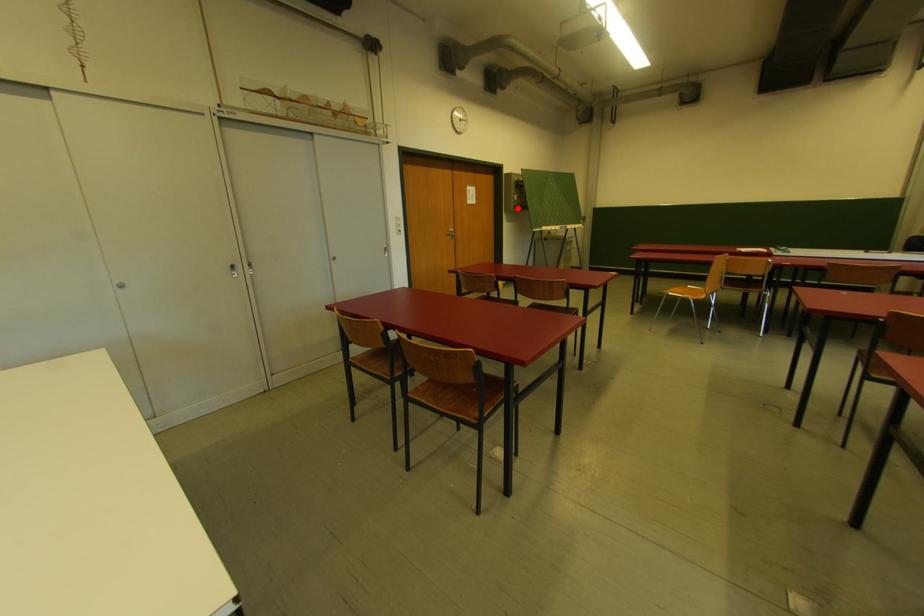
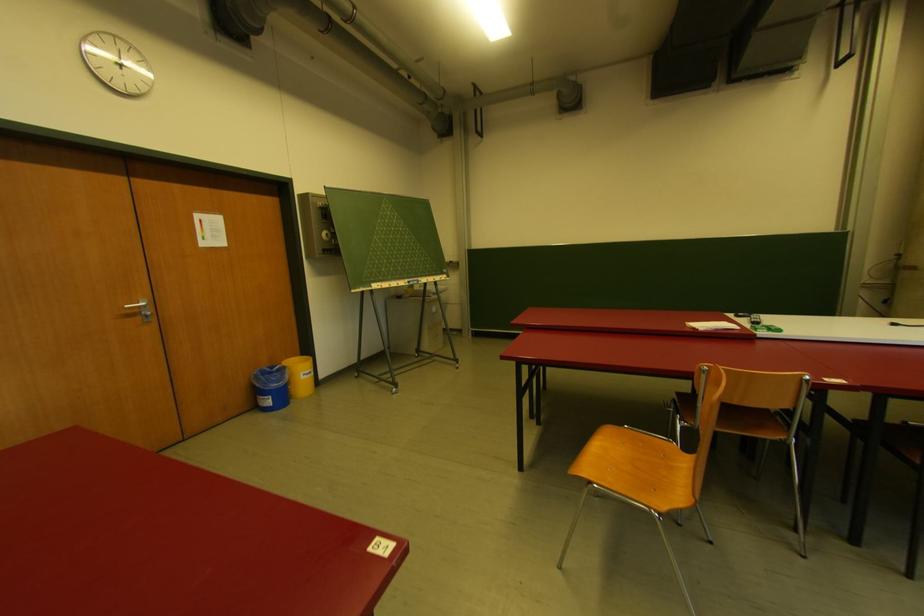
Question: I am providing you with two images of the same scene from different viewpoints. Image1 has a red point marked. In image2, the corresponding 3D location appears at what relative position? Reply with the corresponding letter.

Choices:
 (A) Closer
 (B) Farther

Answer: (B)